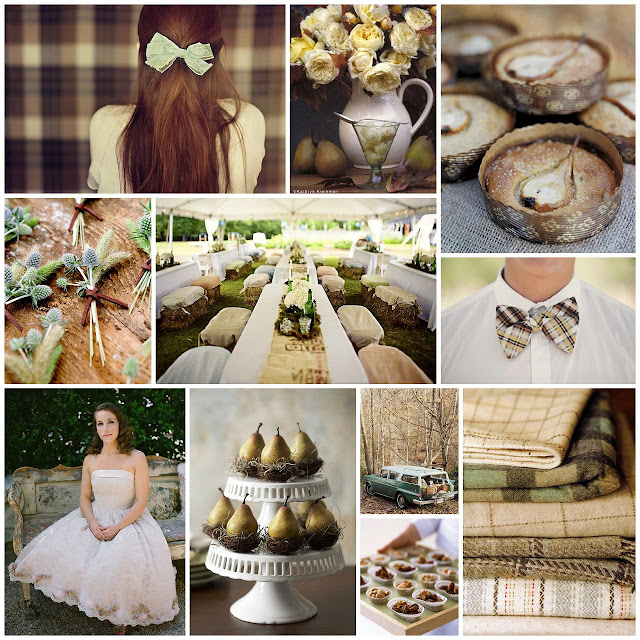
Image resolution: width=640 pixels, height=640 pixels. I want to click on table, so click(x=289, y=365).